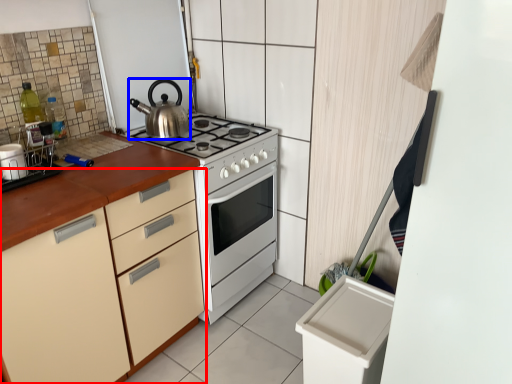
Question: Among these objects, which one is farthest to the camera, cabinetry (highlighted by a red box) or kettle (highlighted by a blue box)?

Choices:
 (A) cabinetry
 (B) kettle

Answer: (B)